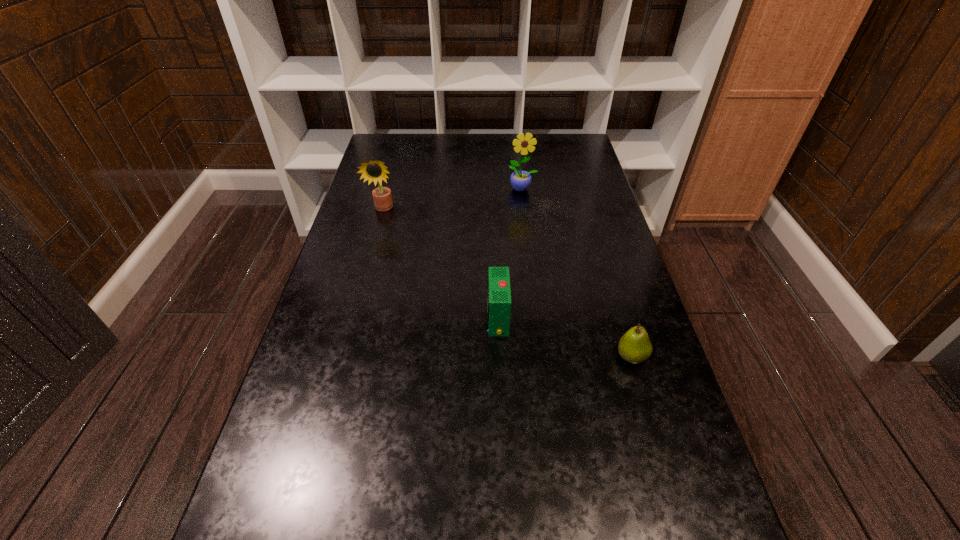
The height and width of the screenshot is (540, 960). Find the location of `free region that satisfies the following two spatial constraints: 1. on the front-facing side of the nearest object; 2. on the right side of the farther sunflower`. free region that satisfies the following two spatial constraints: 1. on the front-facing side of the nearest object; 2. on the right side of the farther sunflower is located at coordinates 543,357.

Locate an element on the screen. This screenshot has width=960, height=540. free spot that satisfies the following two spatial constraints: 1. on the front-facing side of the farthest object; 2. on the front-facing side of the alarm clock is located at coordinates (539, 319).

Find the location of `free location that satisfies the following two spatial constraints: 1. on the face of the rightmost object; 2. on the right side of the nearer sunflower`. free location that satisfies the following two spatial constraints: 1. on the face of the rightmost object; 2. on the right side of the nearer sunflower is located at coordinates pos(343,357).

At what (x,y) coordinates should I click in order to perform the action: click on vacant space that satisfies the following two spatial constraints: 1. on the front-facing side of the rightmost object; 2. on the right side of the farthest object. Please return your answer as a coordinate pair (x, y). Looking at the image, I should click on (543, 357).

This screenshot has width=960, height=540. I want to click on free space that satisfies the following two spatial constraints: 1. on the front-facing side of the third farthest object; 2. on the right side of the nearest object, so click(499, 357).

You are a GUI agent. You are given a task and a screenshot of the screen. Output one action in this format:
    pyautogui.click(x=<x>, y=<y>)
    Task: Click on the vacant region that satisfies the following two spatial constraints: 1. on the front-facing side of the pear; 2. on the right side of the farthest object
    
    Given the screenshot: What is the action you would take?
    pos(543,357)

At what (x,y) coordinates should I click in order to perform the action: click on vacant point that satisfies the following two spatial constraints: 1. on the front-facing side of the third object from left to right; 2. on the right side of the pear. Please return your answer as a coordinate pair (x, y). The height and width of the screenshot is (540, 960). Looking at the image, I should click on (543, 357).